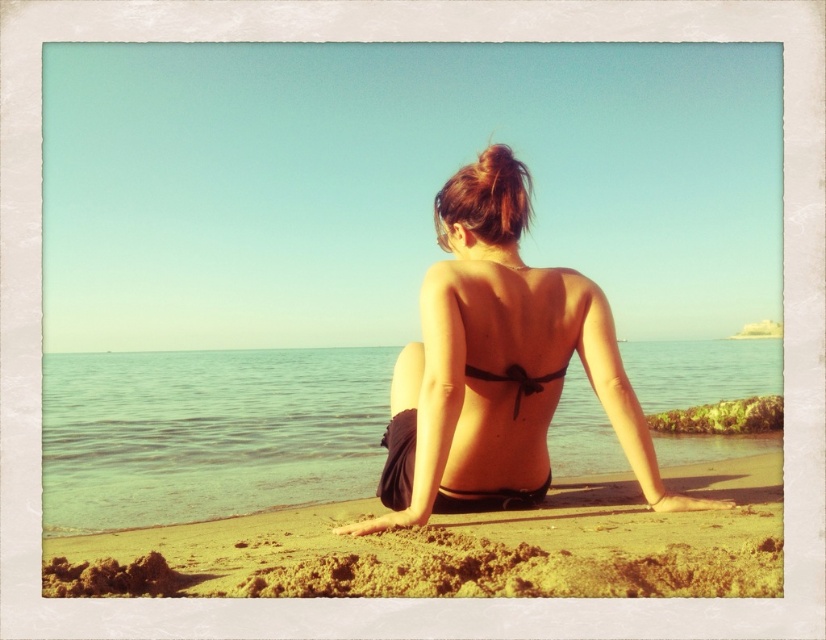
Question: Which is farther from the clear water at center?

Choices:
 (A) black matte bikini top at center
 (B) fine-grained sand at lower center

Answer: (B)

Question: Can you confirm if clear water at center is bigger than black satin bikini top at center?

Choices:
 (A) no
 (B) yes

Answer: (B)

Question: Estimate the real-world distances between objects in this image. Which object is farther from the black satin bikini top at center?

Choices:
 (A) black matte bikini top at center
 (B) fine-grained sand at lower center

Answer: (B)

Question: Can you confirm if clear water at center is positioned below fine-grained sand at lower center?

Choices:
 (A) yes
 (B) no

Answer: (B)

Question: Is clear water at center positioned before black satin bikini top at center?

Choices:
 (A) no
 (B) yes

Answer: (A)

Question: Which object is the closest to the fine-grained sand at lower center?

Choices:
 (A) black matte bikini top at center
 (B) black satin bikini top at center

Answer: (A)